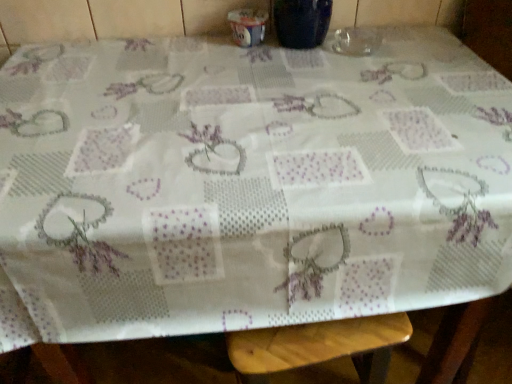
What are the coordinates of `vacant area that is in front of matte dark blue glass vase at upper center` in the screenshot? It's located at (310, 72).